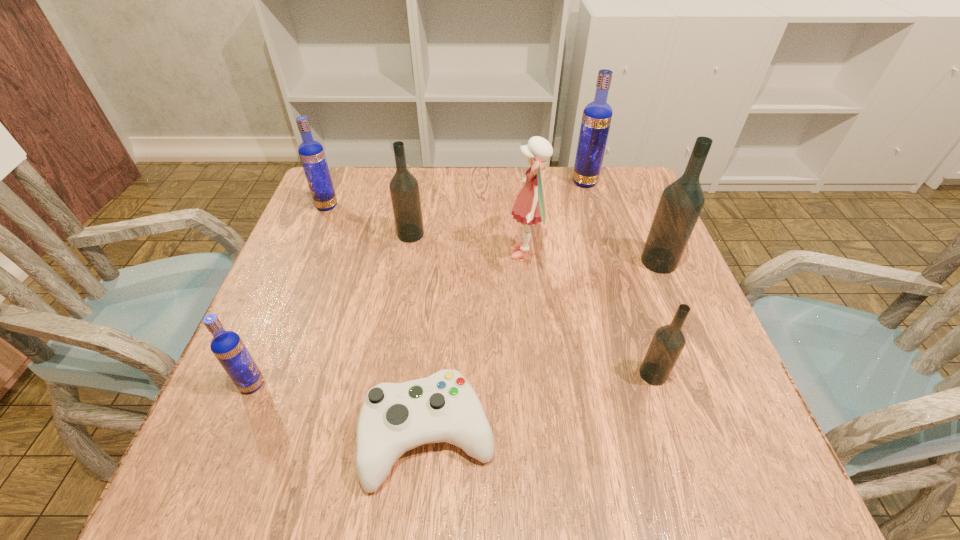
The height and width of the screenshot is (540, 960). I want to click on the biggest blue vodka, so click(596, 119).

You are a GUI agent. You are given a task and a screenshot of the screen. Output one action in this format:
    pyautogui.click(x=<x>, y=<y>)
    Task: Click on the farthest object
    This screenshot has width=960, height=540.
    Given the screenshot: What is the action you would take?
    pyautogui.click(x=596, y=119)

This screenshot has height=540, width=960. I want to click on the rightmost black vodka, so click(x=681, y=202).

The image size is (960, 540). Identify the location of the rightmost object. click(x=681, y=202).

Where is `the fifth object from left to right`? The image size is (960, 540). the fifth object from left to right is located at coordinates (530, 207).

This screenshot has width=960, height=540. In order to click on doll in this screenshot , I will do `click(530, 207)`.

Where is `the second farthest vodka`? The image size is (960, 540). the second farthest vodka is located at coordinates (311, 153).

Identify the location of the second farthest object. (311, 153).

Identify the location of the leftmost black vodka. (404, 189).

Locate an element on the screen. the farthest black vodka is located at coordinates (404, 189).